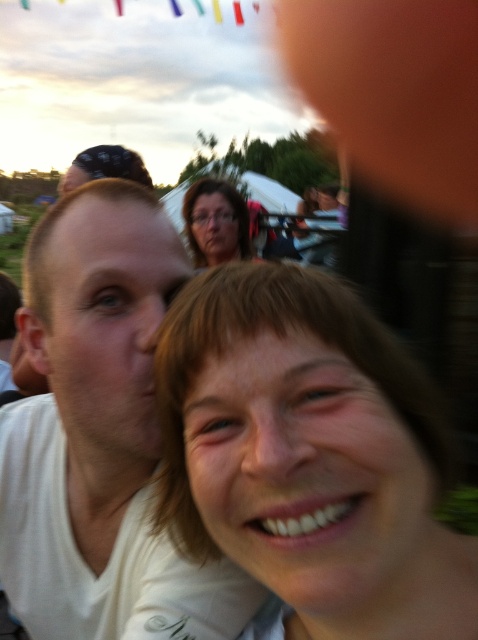
You are a photographer trying to focus on the smooth beige shirt at center in the image. What are the coordinates where you should aim your camera?

The smooth beige shirt at center is located at coordinates point (x=308, y=452), so you should aim your camera there.

You are a photographer trying to adjust the lighting for a portrait. You notice the smooth beige shirt at center and the matte black glasses at upper center in your frame. Which object should you focus on first if you want to ensure both are in focus, considering their positions?

The smooth beige shirt at center is not as tall as matte black glasses at upper center, so you should focus on the matte black glasses at upper center first since it is taller and requires proper focus to capture details.